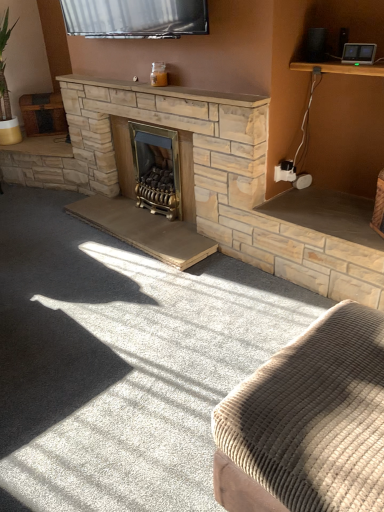
Question: Is corduroy fabric ottoman at lower right aimed at gold metallic wood burning stove at center?

Choices:
 (A) no
 (B) yes

Answer: (A)

Question: Is corduroy fabric ottoman at lower right not within gold metallic wood burning stove at center?

Choices:
 (A) no
 (B) yes

Answer: (B)

Question: Does corduroy fabric ottoman at lower right have a greater width compared to gold metallic wood burning stove at center?

Choices:
 (A) no
 (B) yes

Answer: (B)

Question: Considering the relative sizes of corduroy fabric ottoman at lower right and gold metallic wood burning stove at center in the image provided, is corduroy fabric ottoman at lower right shorter than gold metallic wood burning stove at center?

Choices:
 (A) no
 (B) yes

Answer: (B)

Question: From a real-world perspective, is corduroy fabric ottoman at lower right beneath gold metallic wood burning stove at center?

Choices:
 (A) no
 (B) yes

Answer: (B)

Question: Looking at the image, does gold metallic wood burning stove at center seem bigger or smaller compared to corduroy fabric ottoman at lower right?

Choices:
 (A) big
 (B) small

Answer: (B)

Question: Is point (162, 139) positioned closer to the camera than point (296, 349)?

Choices:
 (A) farther
 (B) closer

Answer: (A)

Question: From a real-world perspective, relative to corduroy fabric ottoman at lower right, is gold metallic wood burning stove at center vertically above or below?

Choices:
 (A) below
 (B) above

Answer: (B)

Question: In the image, is gold metallic wood burning stove at center on the left side or the right side of corduroy fabric ottoman at lower right?

Choices:
 (A) right
 (B) left

Answer: (B)

Question: Is smooth stone mantle at upper center spatially inside gold metallic wood burning stove at center, or outside of it?

Choices:
 (A) inside
 (B) outside

Answer: (B)

Question: In terms of size, does smooth stone mantle at upper center appear bigger or smaller than gold metallic wood burning stove at center?

Choices:
 (A) big
 (B) small

Answer: (B)

Question: From their relative heights in the image, would you say smooth stone mantle at upper center is taller or shorter than gold metallic wood burning stove at center?

Choices:
 (A) tall
 (B) short

Answer: (B)

Question: Is point (206, 94) closer or farther from the camera than point (178, 200)?

Choices:
 (A) closer
 (B) farther

Answer: (A)

Question: Considering the positions of point (273, 389) and point (167, 88), is point (273, 389) closer or farther from the camera than point (167, 88)?

Choices:
 (A) farther
 (B) closer

Answer: (B)

Question: Looking at their shapes, would you say corduroy fabric ottoman at lower right is wider or thinner than smooth stone mantle at upper center?

Choices:
 (A) thin
 (B) wide

Answer: (B)